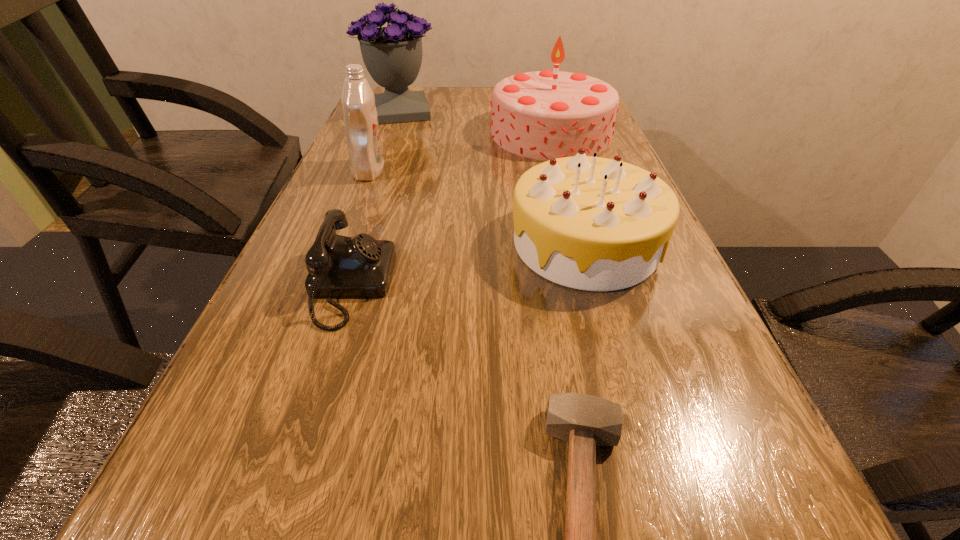
What are the coordinates of `bouquet` in the screenshot? It's located at (392, 55).

The height and width of the screenshot is (540, 960). I want to click on the taller birthday cake, so click(x=542, y=115).

Locate an element on the screen. Image resolution: width=960 pixels, height=540 pixels. detergent is located at coordinates (361, 124).

Where is `the shorter birthday cake`? The image size is (960, 540). the shorter birthday cake is located at coordinates (589, 223).

The width and height of the screenshot is (960, 540). Identify the location of the nearer birthday cake. (589, 223).

This screenshot has height=540, width=960. I want to click on telephone, so click(x=340, y=267).

Where is `vacant space situated on the right of the bouquet`? Image resolution: width=960 pixels, height=540 pixels. vacant space situated on the right of the bouquet is located at coordinates (466, 111).

You are a GUI agent. You are given a task and a screenshot of the screen. Output one action in this format:
    pyautogui.click(x=<x>, y=<y>)
    Task: Click on the vacant space located on the front of the taller birthday cake
    The image size is (960, 540).
    Given the screenshot: What is the action you would take?
    click(x=579, y=233)

The width and height of the screenshot is (960, 540). Find the location of `vacant area located 0.230m on the back of the detergent`. vacant area located 0.230m on the back of the detergent is located at coordinates (387, 124).

I want to click on free space located 0.180m on the front of the shorter birthday cake, so coord(625,380).